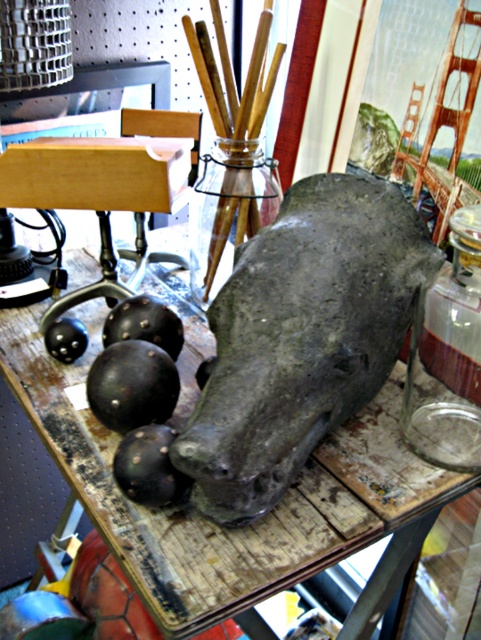
What are the coordinates of the rusty wood table at center?

The coordinates of the rusty wood table at center are at point (226,528).

You are standing at the entrance of the studio and see the point marked at coordinates (226, 528). Based on the scene, can you tell me what surface this point is located on?

The point marked at coordinates (226, 528) is located on the rusty wood table at center.

You are an artist who needs to place a 10 inch long paintbrush between the rusty wood table at center and the transparent glass jar at center. Can you fit it horizontally between them?

The distance between the rusty wood table at center and the transparent glass jar at center is 10.23 inches, so yes, the 10 inch paintbrush can fit horizontally between them since it is slightly shorter than the available space.